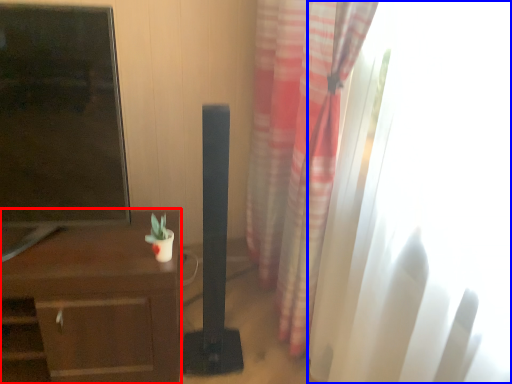
Question: Which object is closer to the camera taking this photo, desk (highlighted by a red box) or window (highlighted by a blue box)?

Choices:
 (A) desk
 (B) window

Answer: (B)